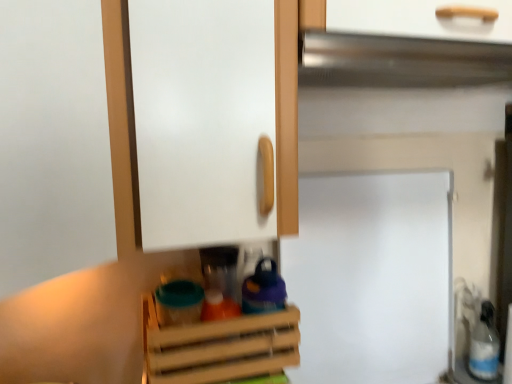
Image resolution: width=512 pixels, height=384 pixels. Identify the location of free space above wooden crate at center (from a real-world perspective). (226, 306).